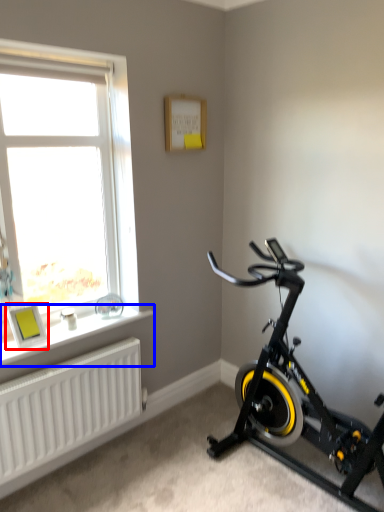
Question: Which object is further to the camera taking this photo, picture frame (highlighted by a red box) or window sill (highlighted by a blue box)?

Choices:
 (A) picture frame
 (B) window sill

Answer: (A)